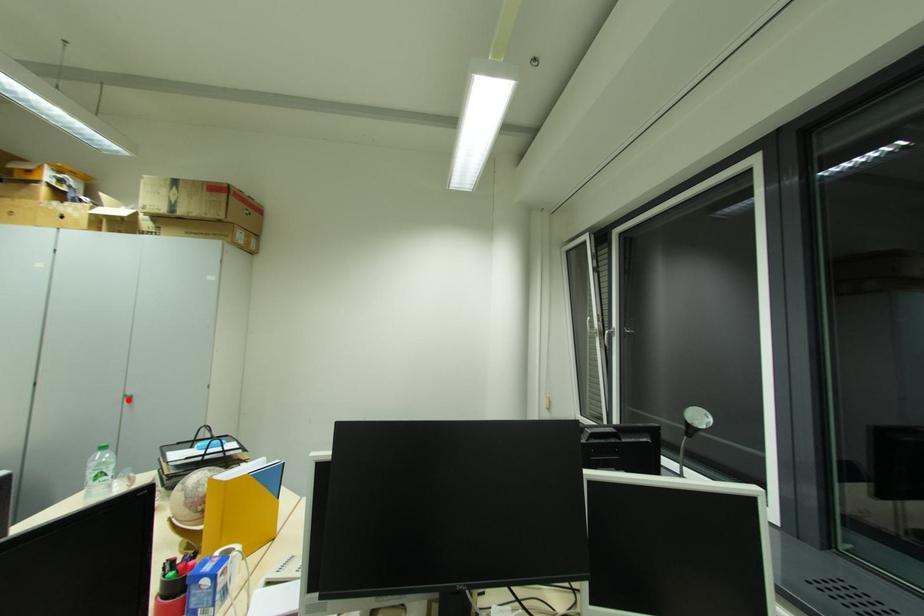
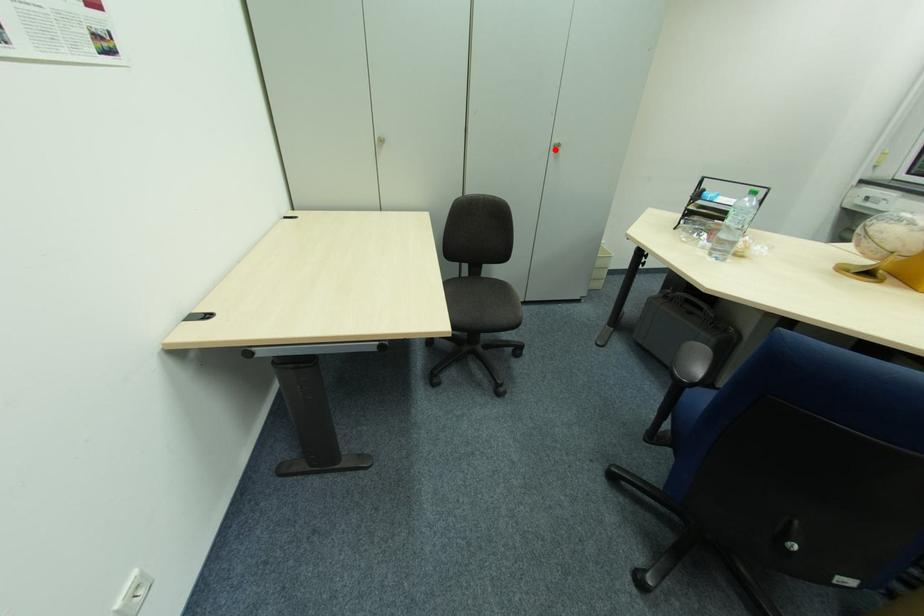
I am providing you with two images of the same scene from different viewpoints. A red point is marked on the first image and another point is marked on the second image. Do the highlighted points in image1 and image2 indicate the same real-world spot?

Yes